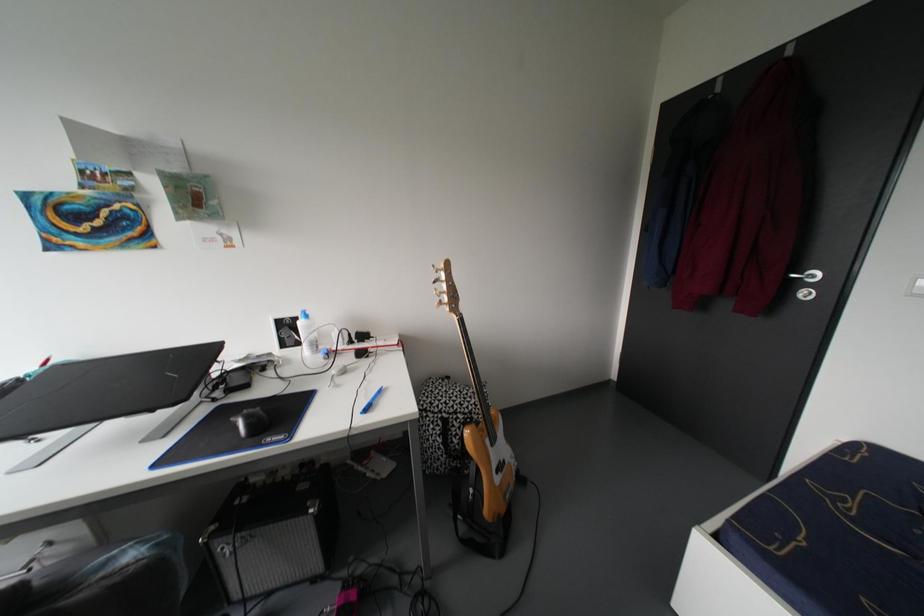
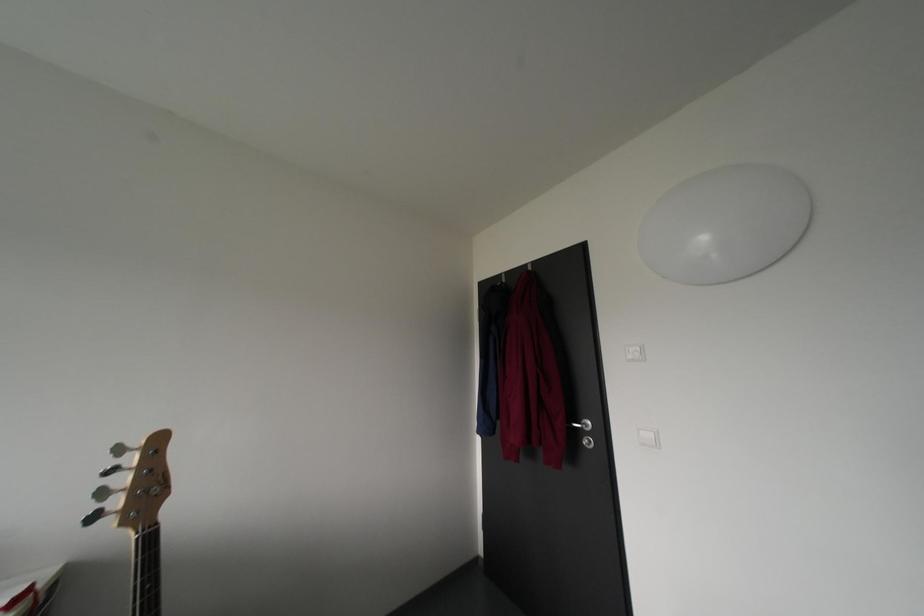
The images are taken continuously from a first-person perspective. In which direction is your viewpoint rotating?

The camera's rotation is toward right-up.